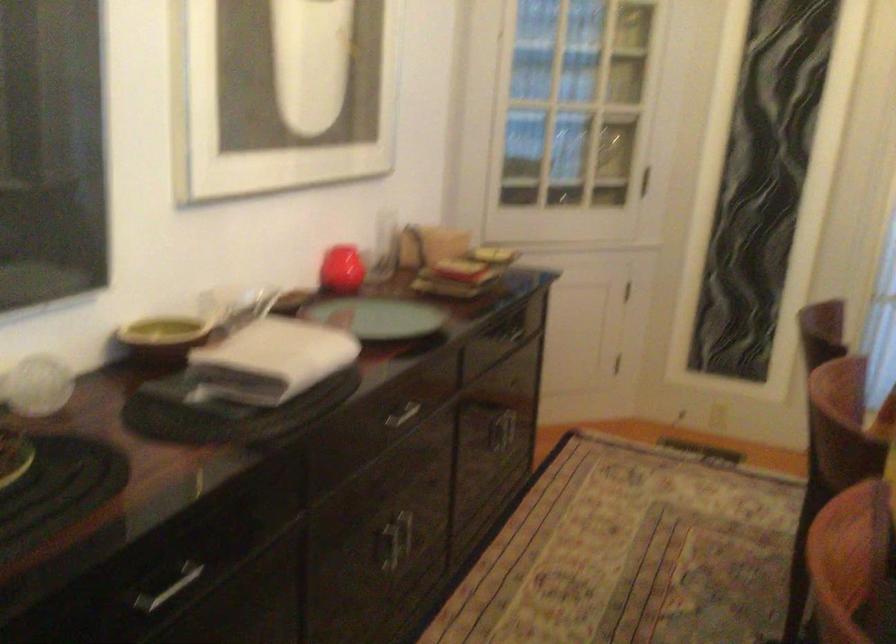
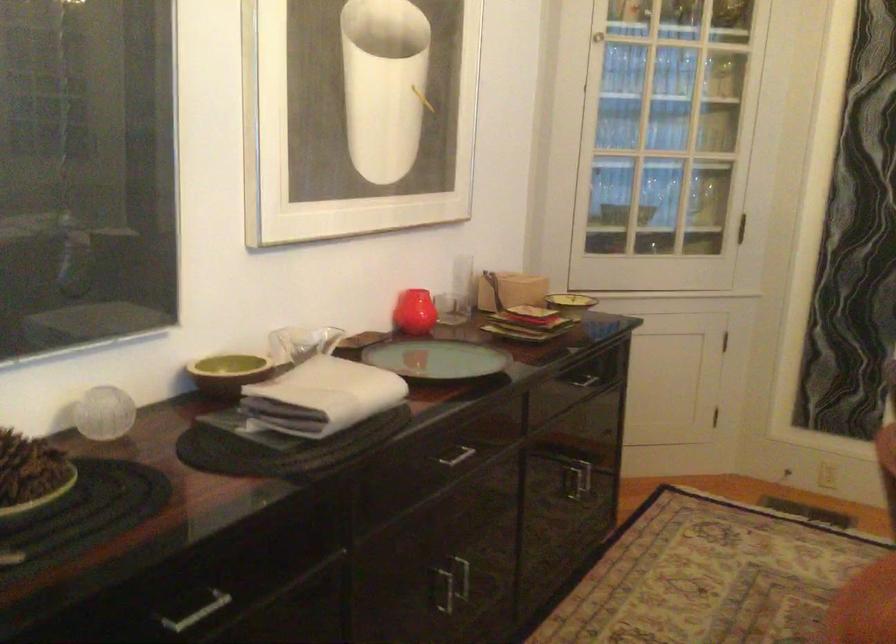
Where in the second image is the point corresponding to (433,243) from the first image?

(510, 290)